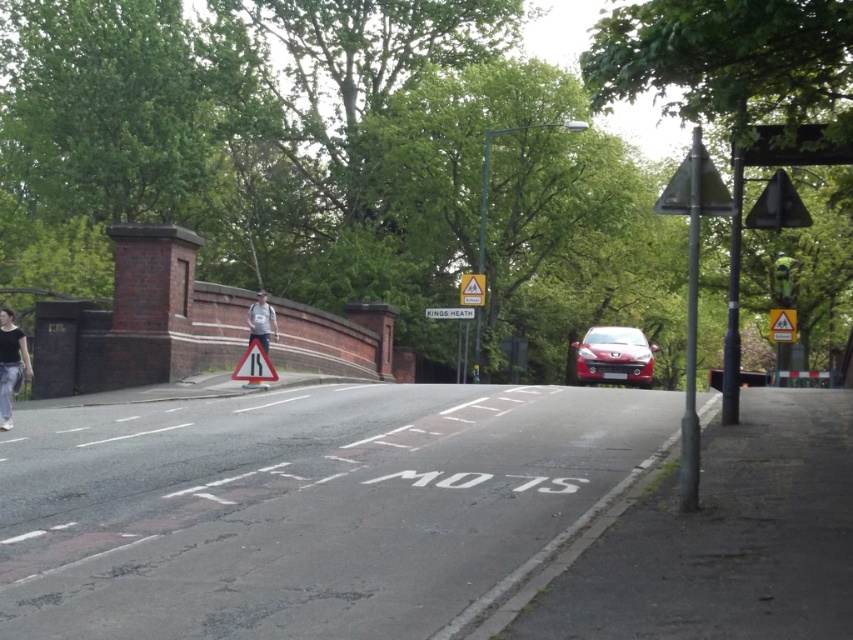
You are standing on the road in the image and see the denim pants at lower left. Where exactly are the denim pants located in the image?

The denim pants at lower left are located at point (10, 364) in the image.

From the picture: You are a pedestrian standing at the edge of the road near the pedestrian crossing. You see the matte red car at center and the white plastic sign at center. Which object is closer to the right side of the road?

The matte red car at center is closer to the right side of the road because it is positioned to the right of the white plastic sign at center.